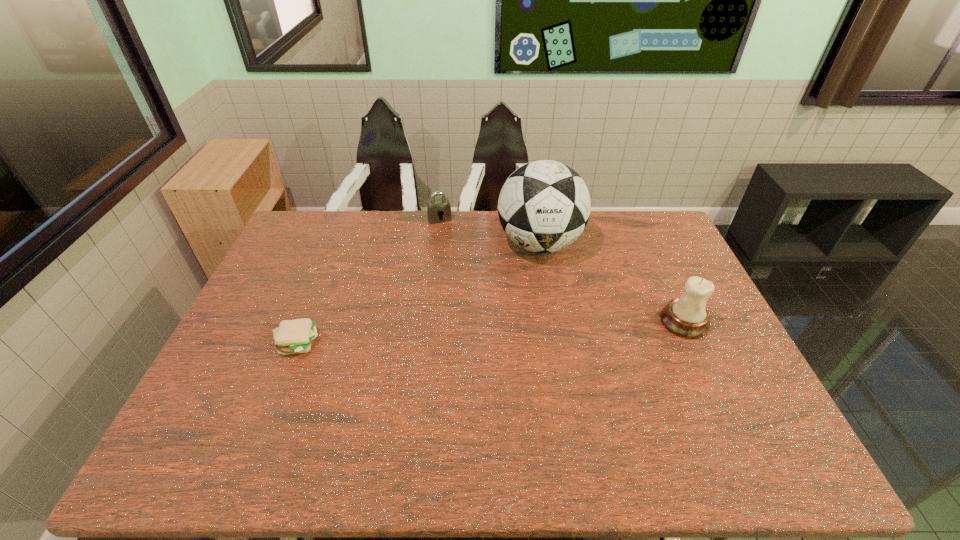
Where is `the leftmost object`? This screenshot has height=540, width=960. the leftmost object is located at coordinates (292, 336).

Identify the location of patty. This screenshot has height=540, width=960. point(292,336).

Where is `the third shortest object`? This screenshot has width=960, height=540. the third shortest object is located at coordinates (687, 317).

I want to click on candle holder, so click(x=687, y=317).

I want to click on soccer ball, so click(544, 206).

This screenshot has width=960, height=540. Find the location of `the tallest object`. the tallest object is located at coordinates (544, 206).

This screenshot has height=540, width=960. I want to click on the second shortest object, so click(440, 208).

You are a GUI agent. You are given a task and a screenshot of the screen. Output one action in this format:
    pyautogui.click(x=<x>, y=<y>)
    Task: Click on the second object from left to right
    
    Given the screenshot: What is the action you would take?
    pyautogui.click(x=440, y=208)

The width and height of the screenshot is (960, 540). Identify the location of free space located 0.230m on the back of the leftmost object. (324, 274).

Image resolution: width=960 pixels, height=540 pixels. In order to click on free space located 0.210m on the back of the candle holder in this screenshot , I will do `click(656, 260)`.